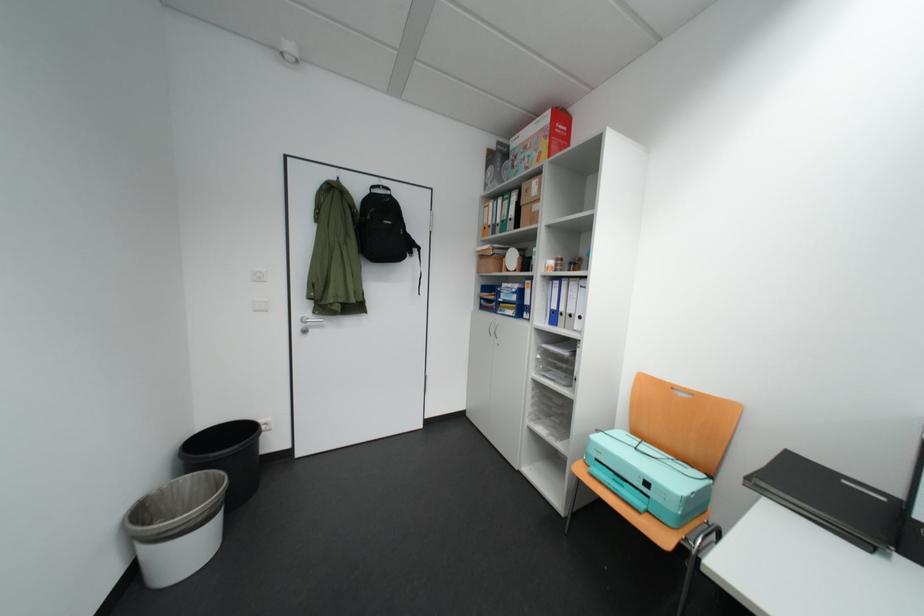
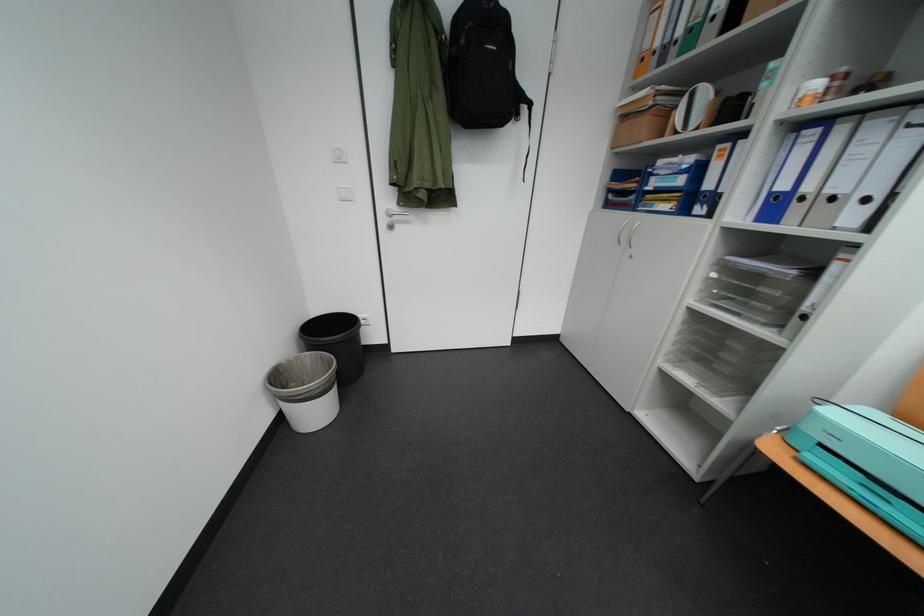
In the second image, find the point that corresponds to [579,313] in the first image.

(841, 193)